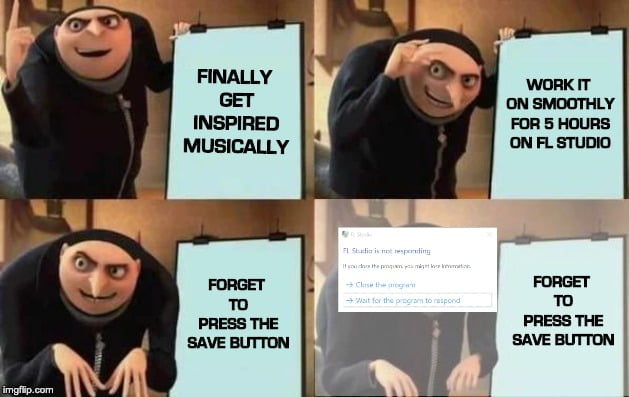
Image resolution: width=629 pixels, height=397 pixels. In order to click on pictures in this screenshot , I will do `click(78, 43)`, `click(341, 44)`, `click(107, 229)`, `click(372, 216)`.